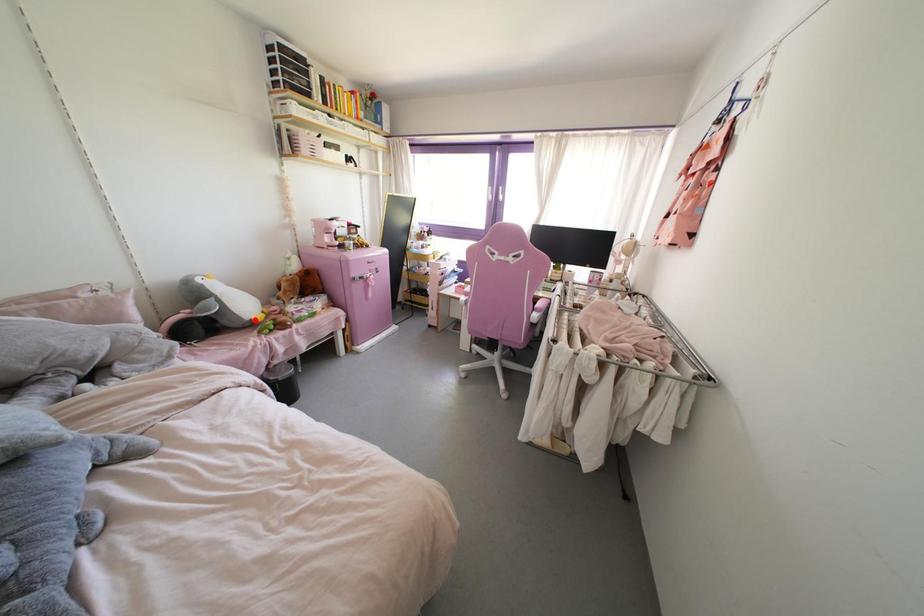
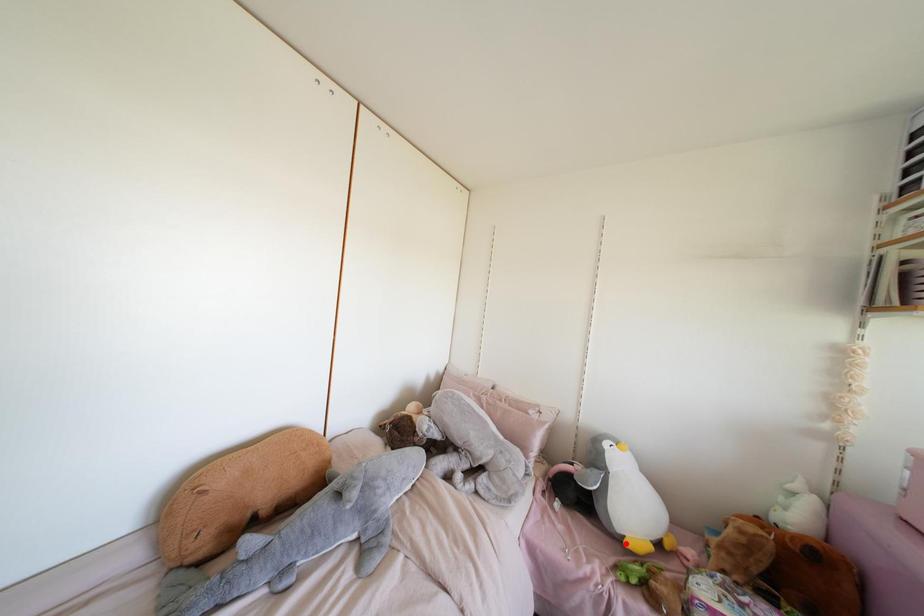
I am providing you with two images of the same scene from different viewpoints. A red point is marked on the first image and another point is marked on the second image. Do the highlighted points in image1 and image2 indicate the same real-world spot?

Yes